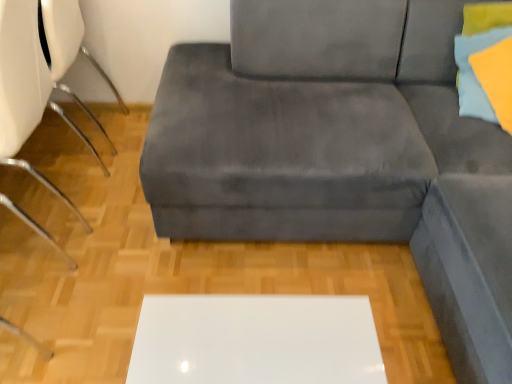
Locate an element on the screen. free area below white plastic swivel chair at left (from a real-world perspective) is located at coordinates (73, 139).